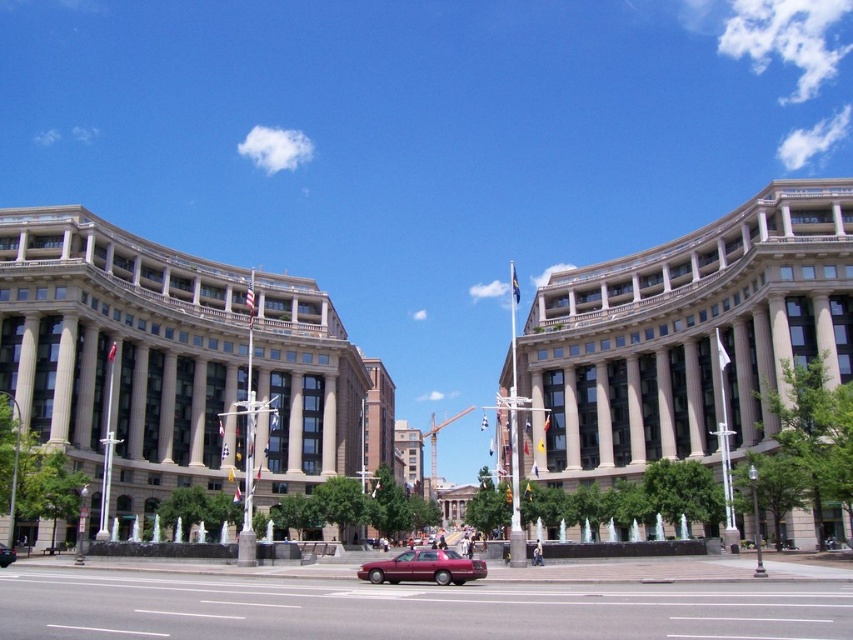
You are a pedestrian standing at the edge of the plaza and see both the shiny maroon sedan at center and the metallic red car at center. Which car is taller?

The metallic red car at center is taller than the shiny maroon sedan at center.

You are standing at the entrance of the plaza and want to cross the street to reach the fountain. There is a shiny maroon sedan at center. Where should you cross the street to avoid the car?

The shiny maroon sedan at center is located at point (x=422, y=566), so you should cross the street at a point not aligned with its position to avoid the car.

You are a pedestrian standing at the edge of the plaza and see both the shiny maroon sedan at center and the metallic red car at center. Which car is closer to you?

The shiny maroon sedan at center is closer to you because it is in front of the metallic red car at center.